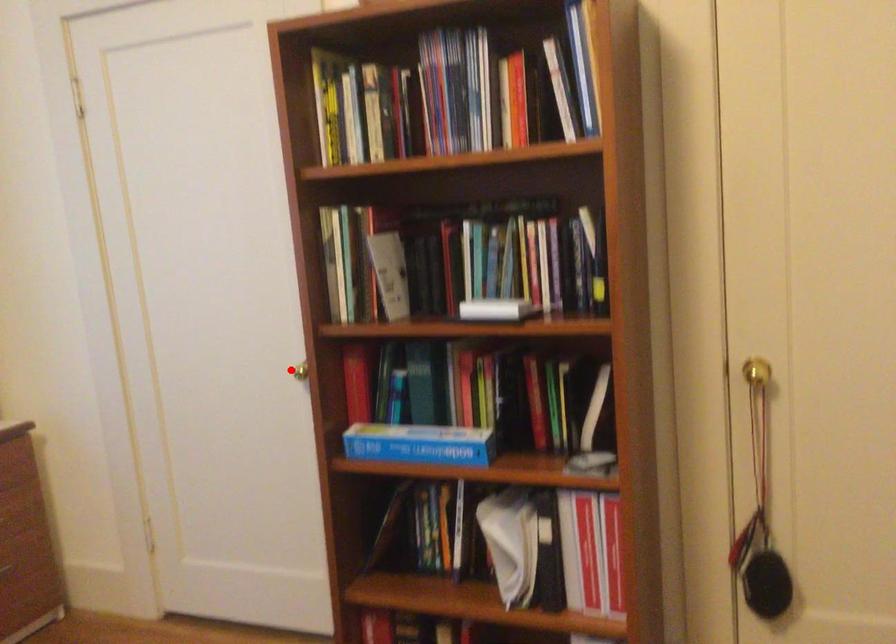
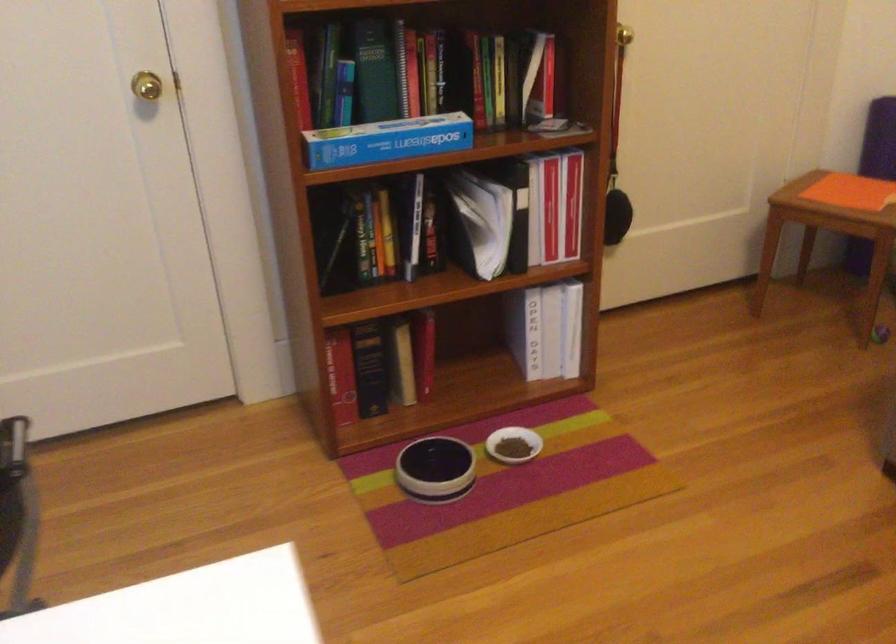
Where in the second image is the point corresponding to the highlighted location from the first image?

(147, 86)